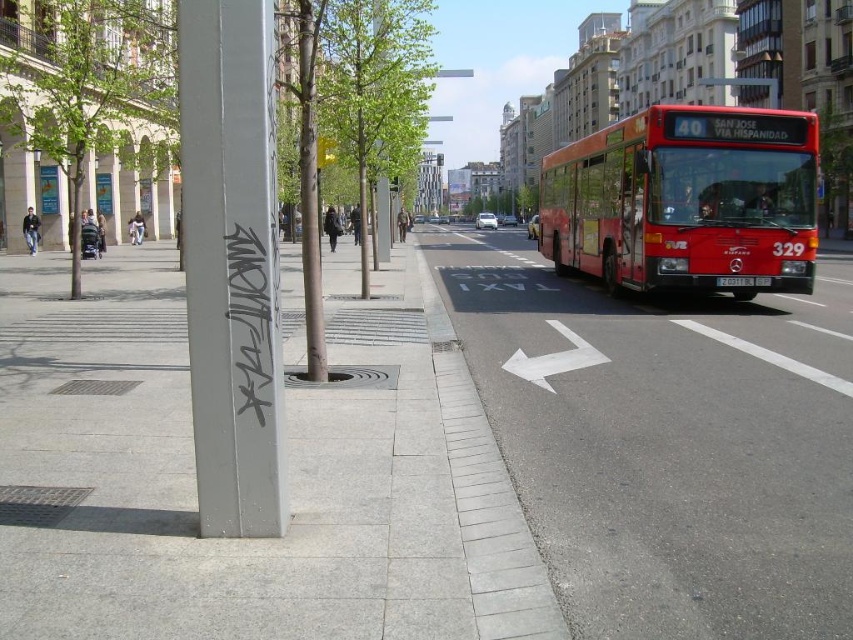
You are a pedestrian standing on the sidewalk. You see the red matte bus at right and the green leafy tree at left. Which object is closer to you?

The red matte bus at right is closer to you because it is in front of the green leafy tree at left.

You are a delivery person trying to place a box on the gray concrete sidewalk at center. The box is 1.5 meters tall. Can the box fit on the gray concrete curb at lower center without tipping over?

The gray concrete sidewalk at center is much taller than the gray concrete curb at lower center. Since the box is 1.5 meters tall, it might not fit stably on the shorter curb, so placing it there could cause instability or tipping.

You are a delivery person carrying a heavy box and need to choose between the gray concrete sidewalk at center and the gray concrete sidewalk at lower left. Which one would be more stable for placing your box?

The gray concrete sidewalk at center is bigger than the gray concrete sidewalk at lower left, so it would provide a more stable surface for placing the box.